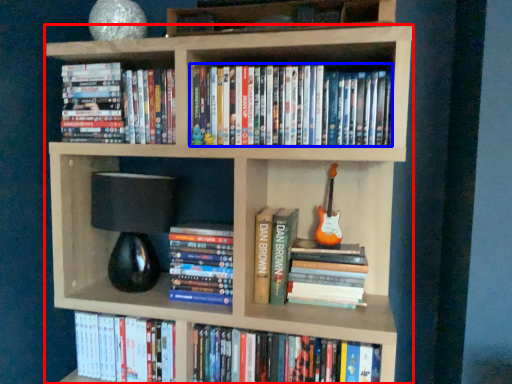
Question: Which of the following is the closest to the observer, bookcase (highlighted by a red box) or book (highlighted by a blue box)?

Choices:
 (A) bookcase
 (B) book

Answer: (A)